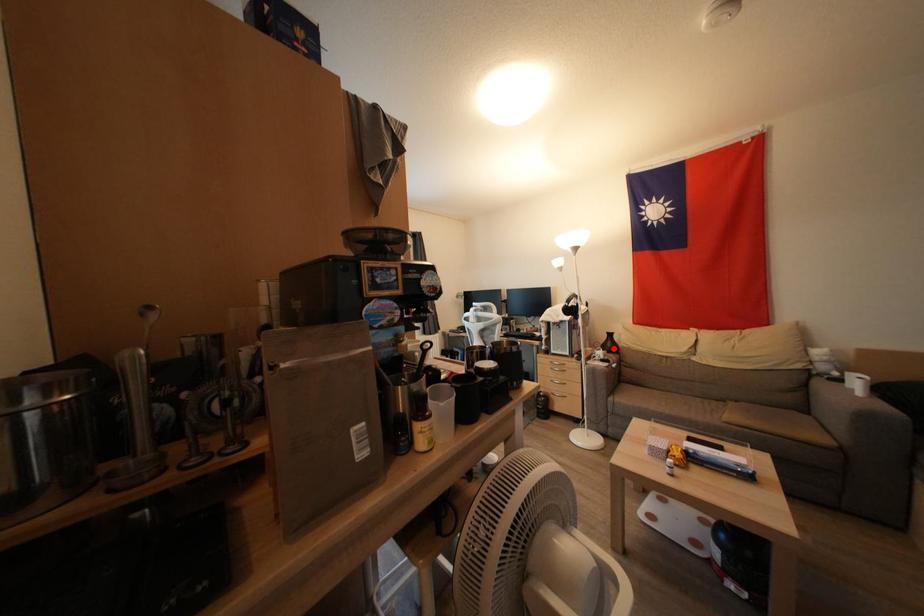
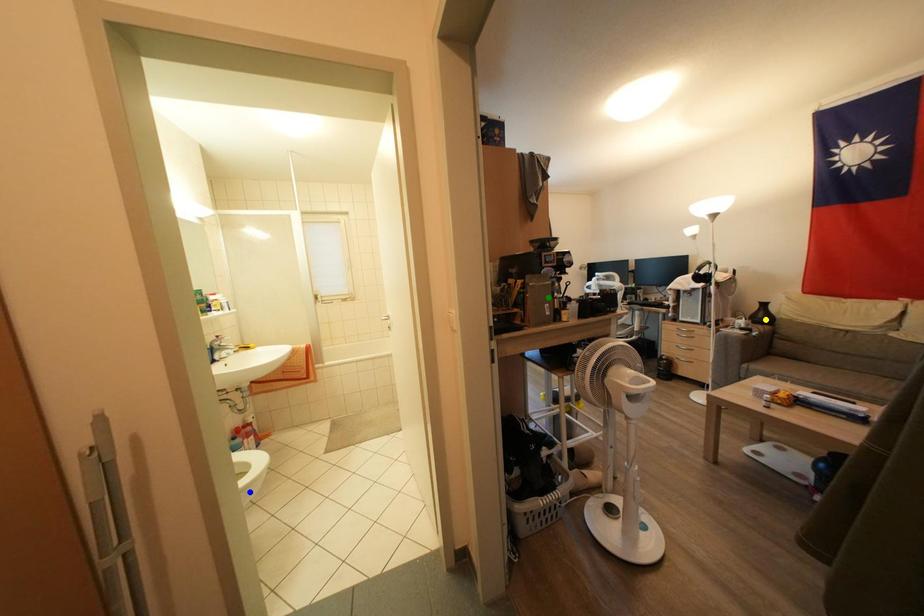
Question: I am providing you with two images of the same scene from different viewpoints. A red point is marked on the first image. You are given multiple points on the second image. Which point in image 2 represents the same 3d spot as the red point in image 1?

Choices:
 (A) yellow point
 (B) blue point
 (C) green point

Answer: (A)